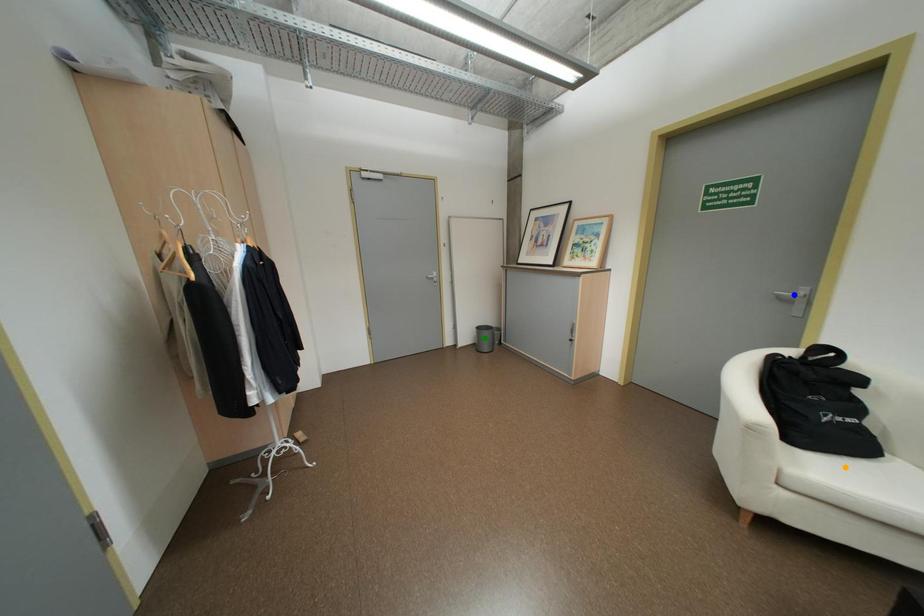
Order these from nearest to farthest:
1. orange point
2. green point
3. blue point

orange point
blue point
green point